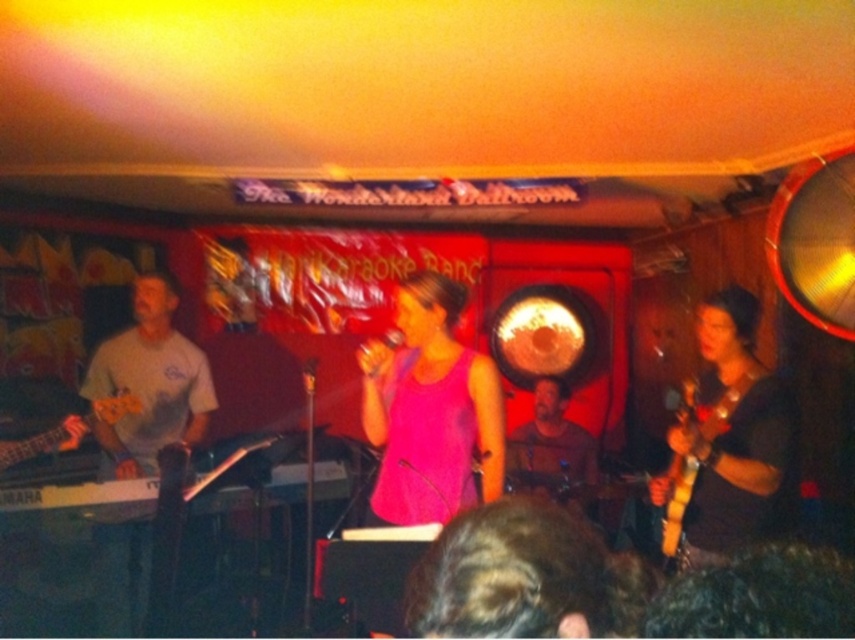
Looking at this image, you are a photographer in the audience. You want to take a photo of the black matte guitar at right and the white matte shirt at left. According to the scene description, which object is positioned higher in the image?

The black matte guitar at right is positioned higher in the image than the white matte shirt at left.

You are a photographer trying to capture both the black matte guitar at right and the yellow wood guitar at right in a single frame. Which guitar should you focus on first to ensure the larger one is properly in focus?

The black matte guitar at right is larger than the yellow wood guitar at right, so you should focus on the black matte guitar at right first to ensure it is properly in focus.

You are an event planner trying to set up a microphone stand for the performer wearing the pink matte tank top at center. Based on the coordinates provided, where should you position the microphone stand relative to the stage?

The pink matte tank top at center is located at point (429,410), so the microphone stand should be positioned near the center of the stage slightly to the right since the coordinates indicate a central position with a slight rightward shift.